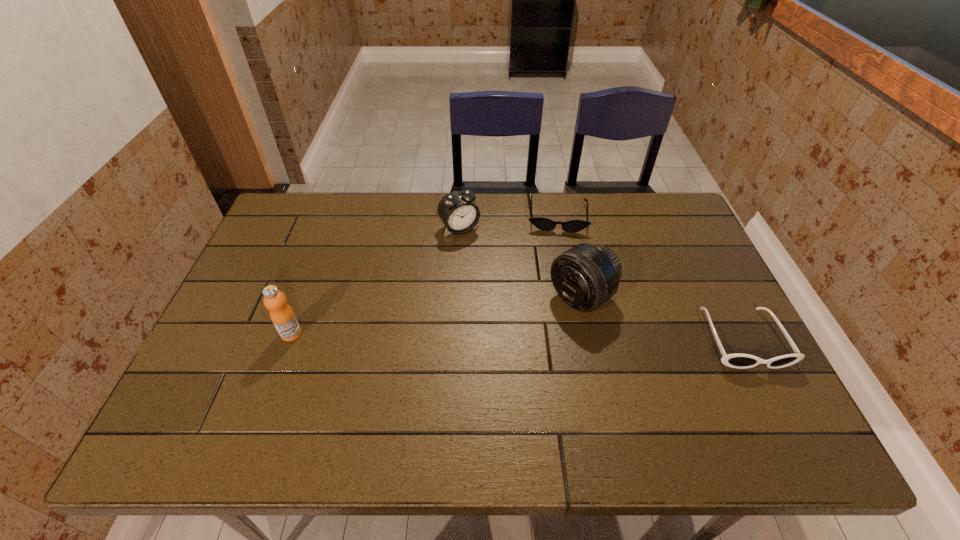
The image size is (960, 540). I want to click on orange juice, so click(x=281, y=314).

Find the location of a particular element. The image size is (960, 540). the nearer sunglasses is located at coordinates (741, 361).

Find the location of a particular element. This screenshot has width=960, height=540. the right sunglasses is located at coordinates (741, 361).

Locate an element on the screen. The image size is (960, 540). alarm clock is located at coordinates (458, 212).

Identify the location of the second object from left to right. The image size is (960, 540). (458, 212).

Identify the location of the shorter sunglasses. The height and width of the screenshot is (540, 960). (545, 224).

Where is `the shortest object`? This screenshot has height=540, width=960. the shortest object is located at coordinates (545, 224).

This screenshot has height=540, width=960. What are the coordinates of `telephoto lens` in the screenshot? It's located at (586, 276).

The width and height of the screenshot is (960, 540). What are the coordinates of `vacant space located 0.230m on the front label of the leftmost object` in the screenshot? It's located at (392, 334).

Identify the location of blank area located with the lenses of the nearer sunglasses facing outward. This screenshot has height=540, width=960. (777, 407).